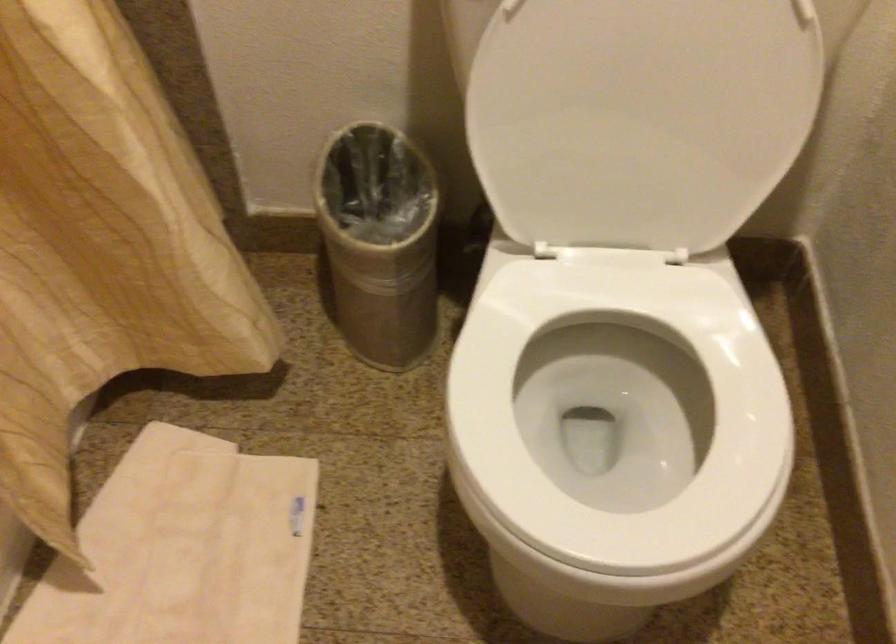
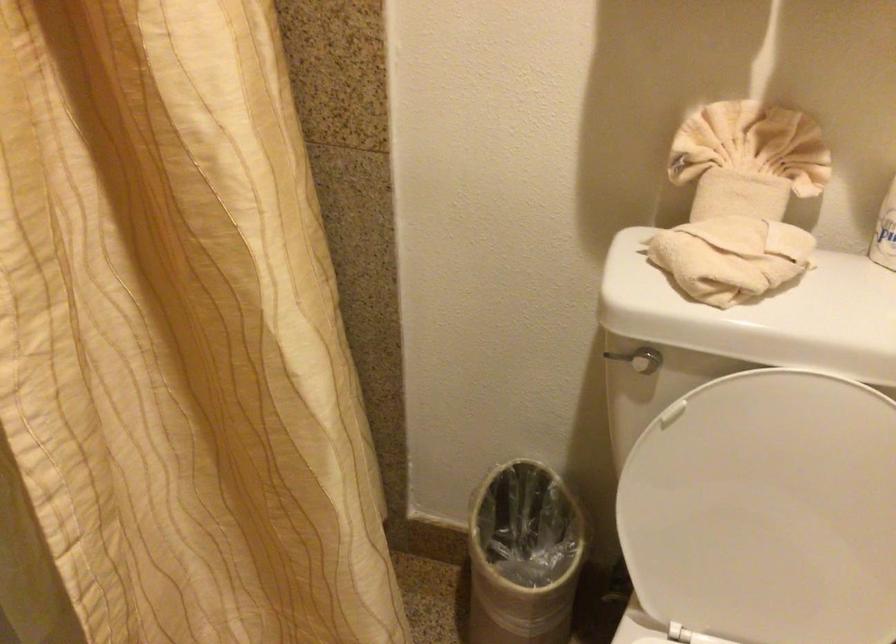
Question: Which direction would the cameraman need to move to produce the second image? Reply with the corresponding letter.

Choices:
 (A) Left
 (B) Right
 (C) Forward
 (D) Backward

Answer: (D)